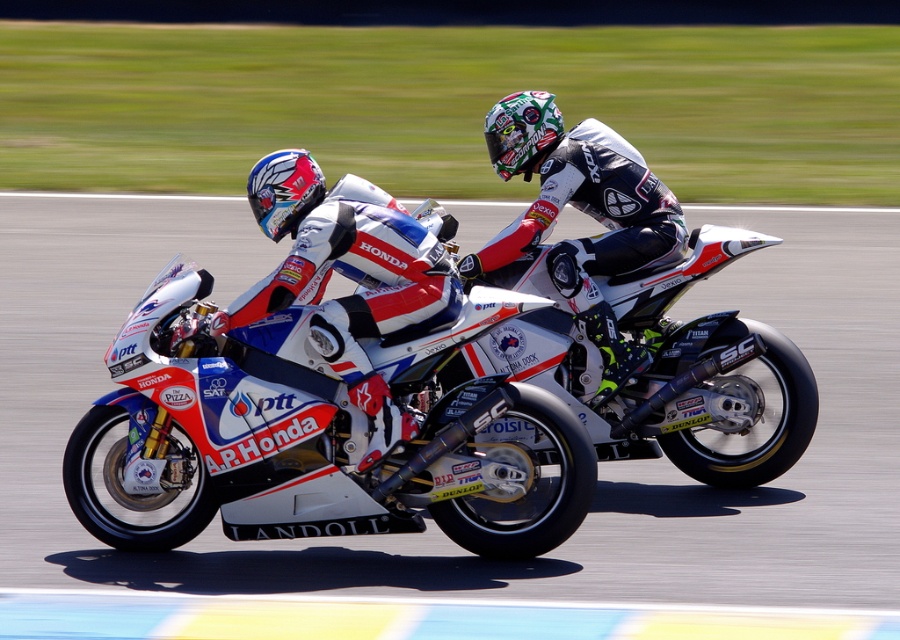
Question: Is white glossy motorcycle at center further to the viewer compared to white leather suit at center?

Choices:
 (A) yes
 (B) no

Answer: (B)

Question: Among these objects, which one is nearest to the camera?

Choices:
 (A) white matte motorcycle at center
 (B) white glossy motorcycle at center

Answer: (B)

Question: In this image, where is white glossy motorcycle at center located relative to white leather suit at center?

Choices:
 (A) above
 (B) below

Answer: (B)

Question: Is the position of white glossy motorcycle at center more distant than that of white/red/blue suit at center?

Choices:
 (A) no
 (B) yes

Answer: (A)

Question: Among these points, which one is nearest to the camera?

Choices:
 (A) (565, 147)
 (B) (538, 394)

Answer: (B)

Question: Which object is positioned closest to the white matte motorcycle at center?

Choices:
 (A) white glossy motorcycle at center
 (B) white/red/blue suit at center
 (C) white leather suit at center

Answer: (C)